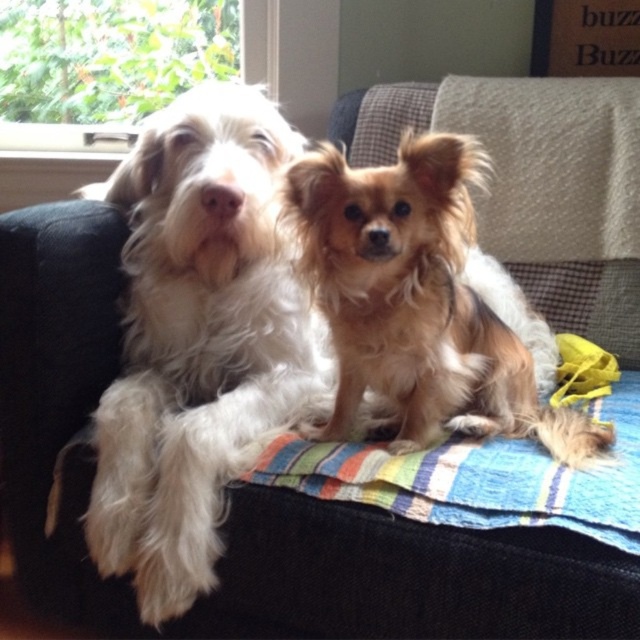
Which is more to the right, golden fur dog at center or striped cotton blanket at center?

Positioned to the right is striped cotton blanket at center.

The height and width of the screenshot is (640, 640). Find the location of `golden fur dog at center`. golden fur dog at center is located at coordinates (419, 301).

Locate an element on the screen. This screenshot has height=640, width=640. golden fur dog at center is located at coordinates (419, 301).

Is point (104, 422) farther from camera compared to point (440, 372)?

Yes, it is.

Is white fluffy dog at left shorter than golden fur dog at center?

Incorrect, white fluffy dog at left's height does not fall short of golden fur dog at center's.

Is point (156, 369) positioned after point (456, 177)?

Yes, it is.

Where is `white fluffy dog at left`? The width and height of the screenshot is (640, 640). white fluffy dog at left is located at coordinates (198, 339).

Describe the element at coordinates (198, 339) in the screenshot. I see `white fluffy dog at left` at that location.

Image resolution: width=640 pixels, height=640 pixels. Describe the element at coordinates (198, 339) in the screenshot. I see `white fluffy dog at left` at that location.

Image resolution: width=640 pixels, height=640 pixels. What are the coordinates of `white fluffy dog at left` in the screenshot? It's located at (198, 339).